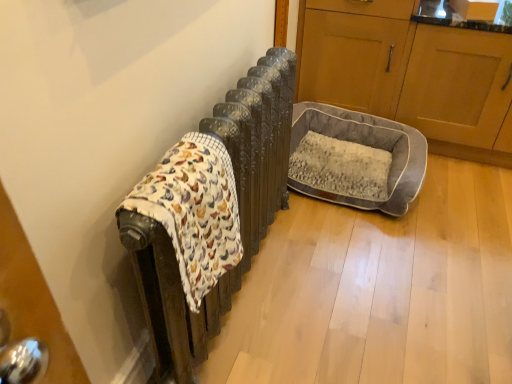
Question: From a real-world perspective, is gray fabric pet bed at right, which is the 1th screen door in back-to-front order, above or below wooden cabinet at right, which appears as the 1th screen door when viewed from the front?

Choices:
 (A) above
 (B) below

Answer: (A)

Question: In terms of width, does gray fabric pet bed at right, which is the 1th screen door in back-to-front order, look wider or thinner when compared to wooden cabinet at right, which appears as the 1th screen door when viewed from the front?

Choices:
 (A) thin
 (B) wide

Answer: (A)

Question: Estimate the real-world distances between objects in this image. Which object is closer to the gray fabric pet bed at right, which is the 1th screen door in back-to-front order?

Choices:
 (A) wooden cabinet at right, which appears as the 1th screen door when viewed from the front
 (B) gray plush dog bed at center
 (C) fluffy cotton blanket at left

Answer: (A)

Question: Based on their relative distances, which object is farther from the gray fabric pet bed at right, which is the 1th screen door in back-to-front order?

Choices:
 (A) fluffy cotton blanket at left
 (B) wooden cabinet at right, acting as the second screen door starting from the back
 (C) gray plush dog bed at center

Answer: (A)